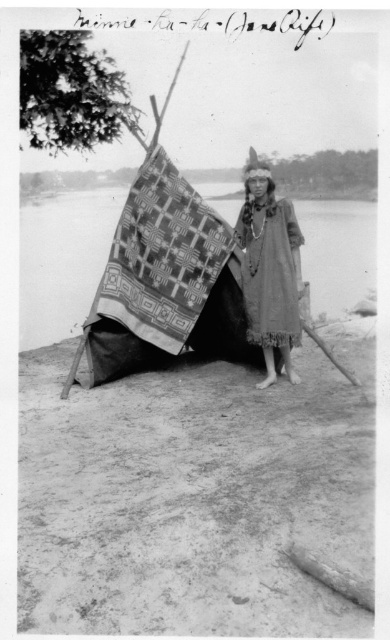
You are an anthropologist examining the photograph and want to determine the spatial relationship between the two items. Which object in the image is taller, the patterned fabric blanket at center or the textured woolen robe at center?

The patterned fabric blanket at center is much taller than the textured woolen robe at center.

You are an anthropologist examining this historical image. You notice the patterned fabric blanket at center and the textured woolen robe at center. How far apart are these two items in inches?

The patterned fabric blanket at center and the textured woolen robe at center are 27.84 inches apart.